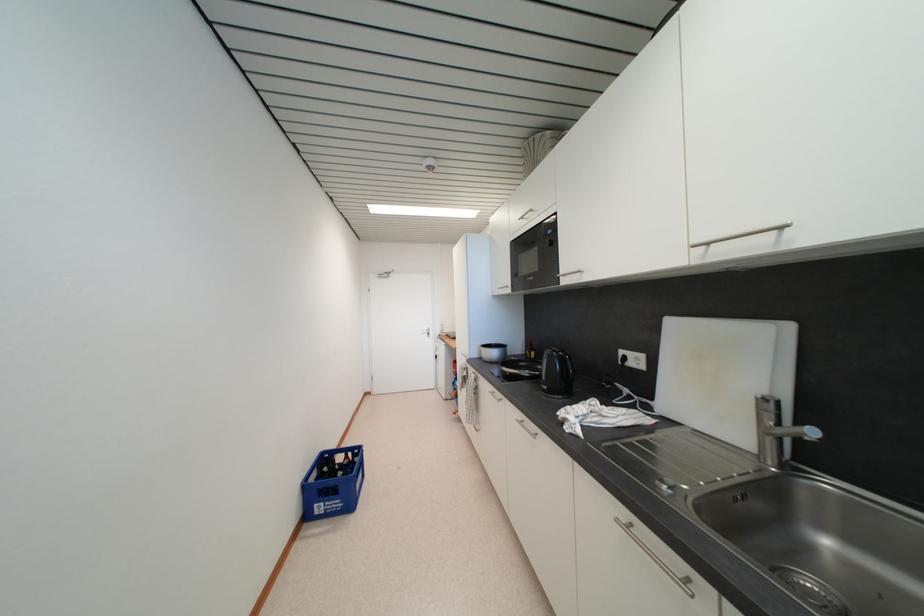
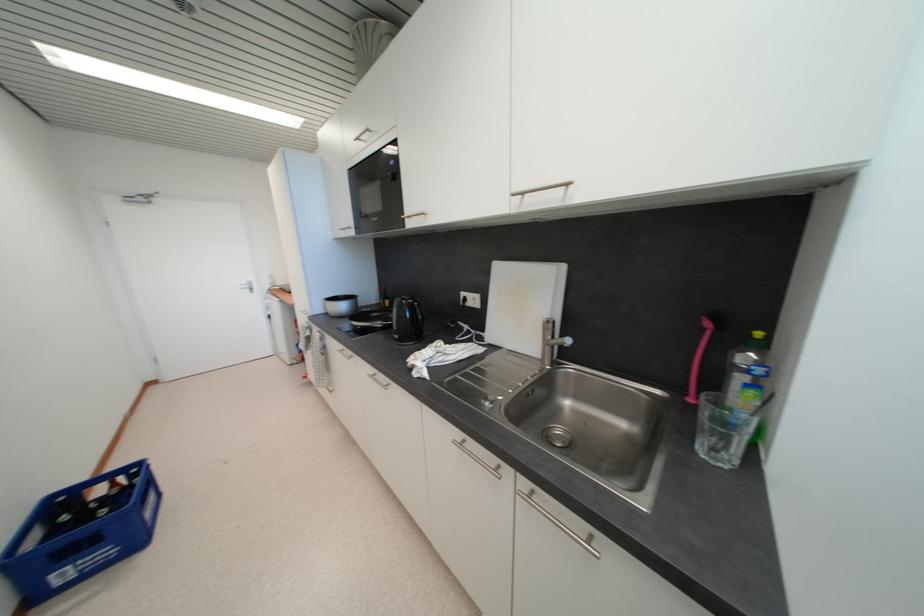
Find the pixel in the second image that matches the point at 496,391 in the first image.

(346, 349)